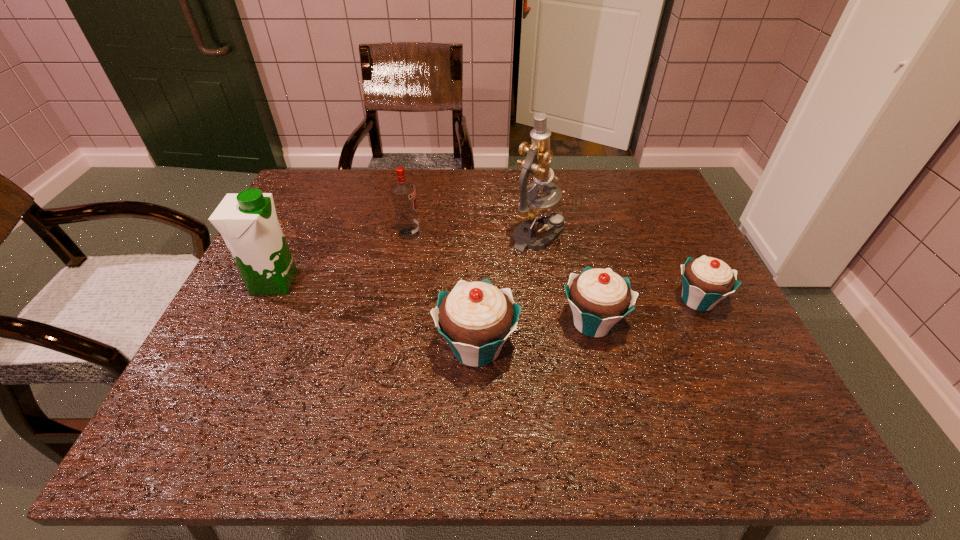
Where is `free space between the vodka and the second shortest cupcake`? Image resolution: width=960 pixels, height=540 pixels. free space between the vodka and the second shortest cupcake is located at coordinates (501, 278).

This screenshot has width=960, height=540. I want to click on free point between the leftmost cupcake and the fifth object from right to left, so click(x=443, y=291).

Select which object is the fifth closest to the second cupcake from left to right. Please provide its 2D coordinates. Your answer should be formatted as a tuple, i.e. [(x, y)], where the tuple contains the x and y coordinates of a point satisfying the conditions above.

[(248, 223)]

Point out which object is positioned as the third nearest to the second shortest cupcake. Please provide its 2D coordinates. Your answer should be formatted as a tuple, i.e. [(x, y)], where the tuple contains the x and y coordinates of a point satisfying the conditions above.

[(532, 208)]

Image resolution: width=960 pixels, height=540 pixels. I want to click on cupcake that is the second closest to the second cupcake from left to right, so click(706, 281).

This screenshot has height=540, width=960. Find the location of `cupcake that can be found as the second closest to the fifth tallest object`. cupcake that can be found as the second closest to the fifth tallest object is located at coordinates (706, 281).

Locate an element on the screen. The image size is (960, 540). vacant position in the image that satisfies the following two spatial constraints: 1. on the front side of the microscope; 2. on the front-facing side of the second tallest object is located at coordinates (544, 282).

Identify the location of free region that satisfies the following two spatial constraints: 1. on the front label of the vodka; 2. on the left side of the leftmost cupcake. The image size is (960, 540). (388, 348).

Image resolution: width=960 pixels, height=540 pixels. I want to click on blank space that satisfies the following two spatial constraints: 1. on the back side of the shortest cupcake; 2. on the front-facing side of the leftmost object, so click(x=689, y=282).

Where is `free region that satisfies the following two spatial constraints: 1. on the front label of the microscope; 2. on the left side of the vodka`? The width and height of the screenshot is (960, 540). free region that satisfies the following two spatial constraints: 1. on the front label of the microscope; 2. on the left side of the vodka is located at coordinates (409, 235).